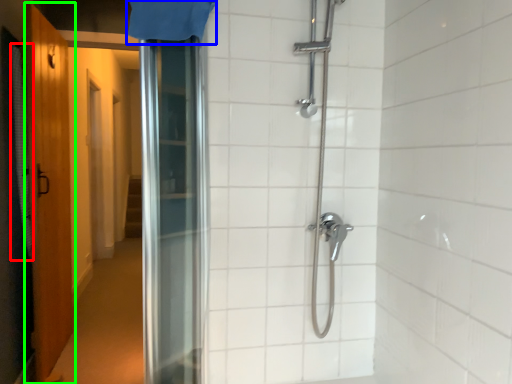
Question: Estimate the real-world distances between objects in this image. Which object is farther from shower curtain (highlighted by a red box), shower curtain (highlighted by a blue box) or door (highlighted by a green box)?

Choices:
 (A) shower curtain
 (B) door

Answer: (A)